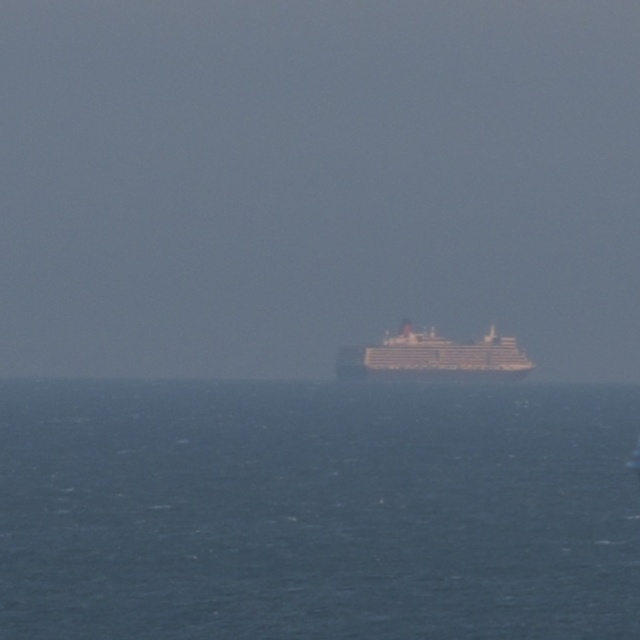
Where is `blue water at center`? The height and width of the screenshot is (640, 640). blue water at center is located at coordinates (317, 509).

Does blue water at center have a larger size compared to white glossy ship at center?

Indeed, blue water at center has a larger size compared to white glossy ship at center.

Is point (243, 602) positioned before point (404, 380)?

Yes, it is in front of point (404, 380).

Identify the location of blue water at center. This screenshot has width=640, height=640. (317, 509).